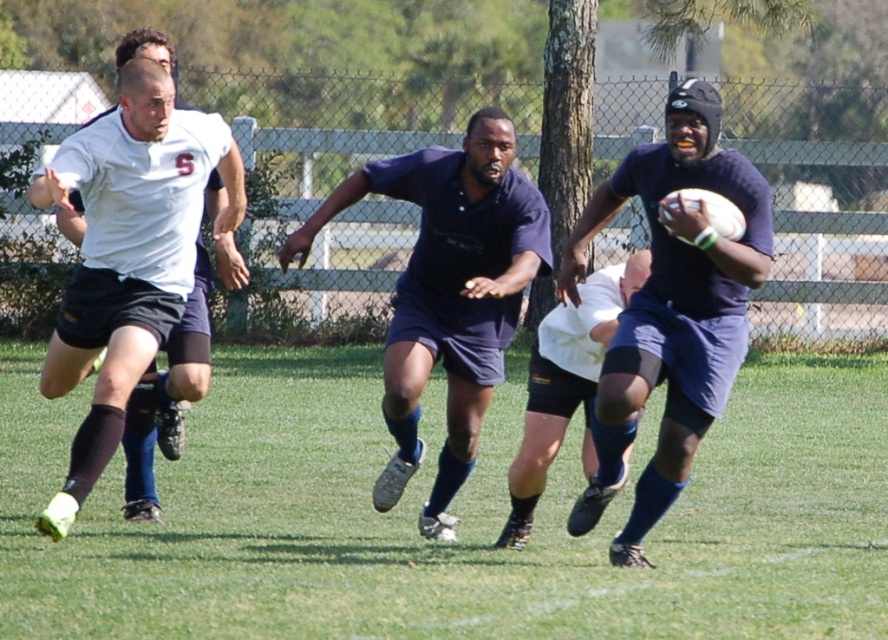
Question: Is dark blue jersey at center to the right of white matte jersey at left from the viewer's perspective?

Choices:
 (A) yes
 (B) no

Answer: (A)

Question: Which object is farther from the camera taking this photo?

Choices:
 (A) white matte rugby ball at center
 (B) navy blue jersey at center

Answer: (A)

Question: Is green grass at center bigger than white matte jersey at left?

Choices:
 (A) yes
 (B) no

Answer: (B)

Question: Which is farther from the white matte jersey at left?

Choices:
 (A) white matte rugby ball at center
 (B) navy blue jersey at center
 (C) green grass at center
 (D) dark blue jersey at center

Answer: (C)

Question: Where is dark blue jersey at center located in relation to navy blue jersey at center in the image?

Choices:
 (A) below
 (B) above

Answer: (B)

Question: Which point appears closest to the camera in this image?

Choices:
 (A) (542, 404)
 (B) (218, 550)
 (C) (627, 520)
 (D) (157, 340)

Answer: (D)